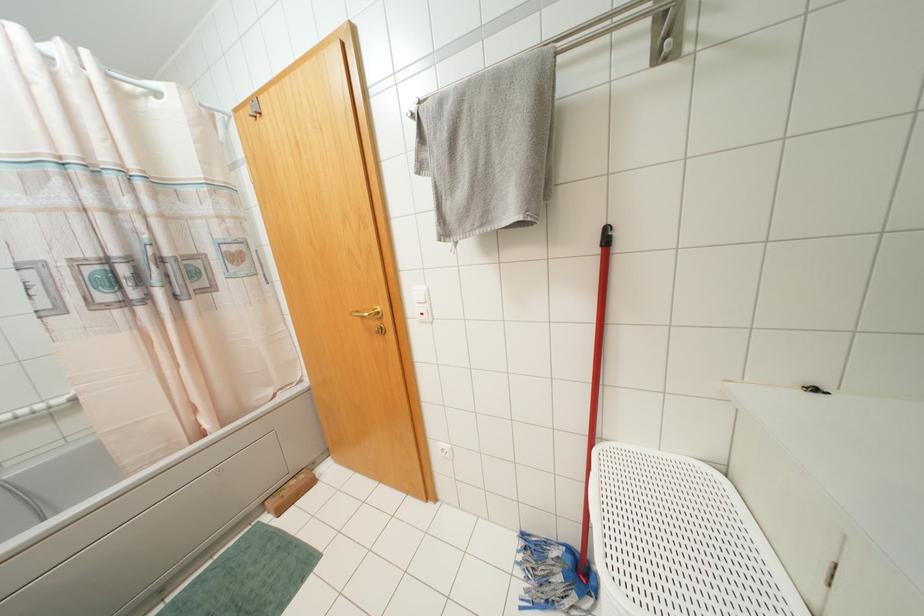
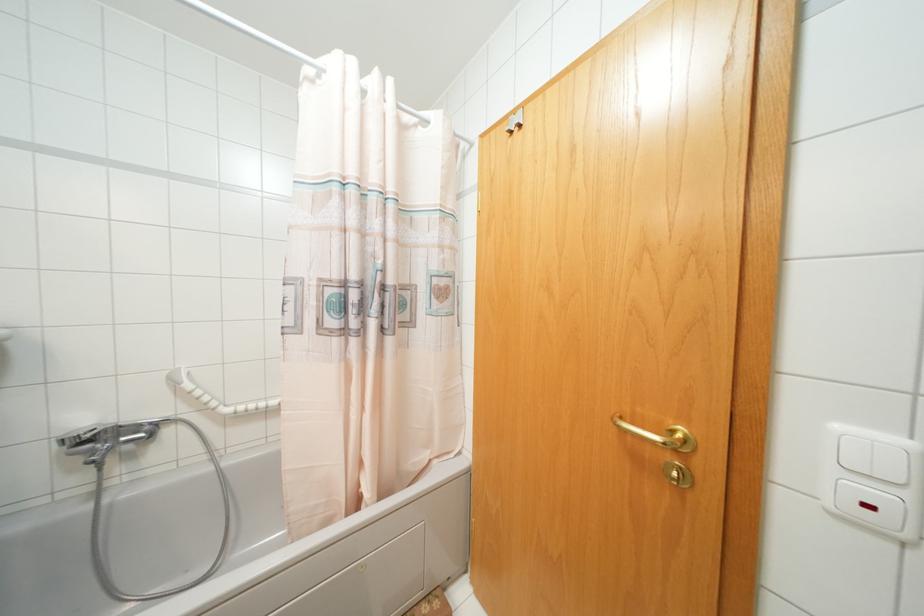
Find the pixel in the second image that matches [378,312] in the first image.

(686, 440)